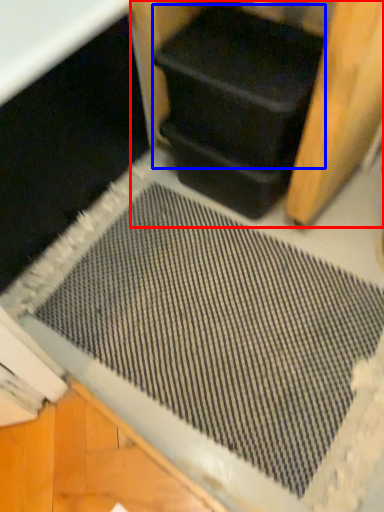
Question: Which of the following is the farthest to the observer, wood (highlighted by a red box) or wide (highlighted by a blue box)?

Choices:
 (A) wood
 (B) wide

Answer: (B)